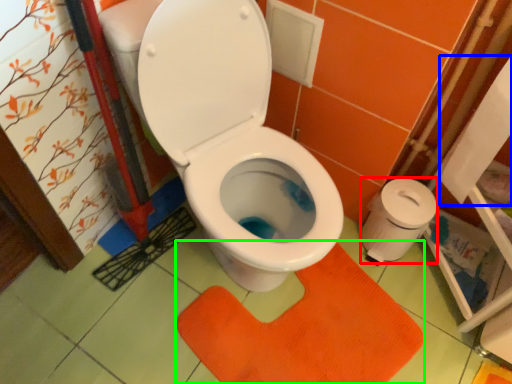
Question: Considering the real-world distances, which object is closest to toilet paper (highlighted by a red box)? toilet paper (highlighted by a blue box) or doormat (highlighted by a green box).

Choices:
 (A) toilet paper
 (B) doormat

Answer: (A)